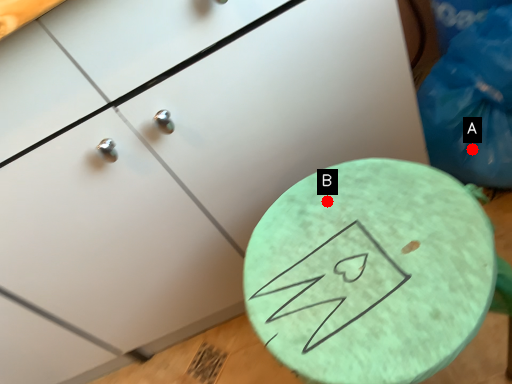
Question: Two points are circled on the image, labeled by A and B beside each circle. Which of the following is the closest to the observer?

Choices:
 (A) A is closer
 (B) B is closer

Answer: (B)